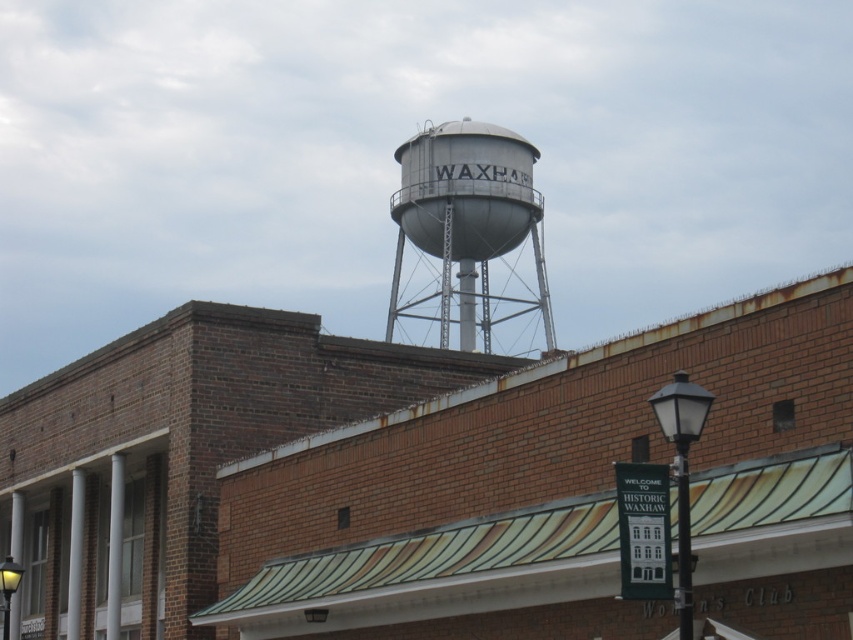
Question: Can you confirm if white metal water tower at upper center is thinner than silver metallic water tower at upper center?

Choices:
 (A) yes
 (B) no

Answer: (B)

Question: Can you confirm if white metal water tower at upper center is positioned to the right of silver metallic water tower at upper center?

Choices:
 (A) yes
 (B) no

Answer: (B)

Question: Which of the following is the closest to the observer?

Choices:
 (A) (300, 547)
 (B) (540, 212)

Answer: (A)

Question: Which object appears farthest from the camera in this image?

Choices:
 (A) silver metallic water tower at upper center
 (B) white metal water tower at upper center

Answer: (A)

Question: Does white metal water tower at upper center lie behind silver metallic water tower at upper center?

Choices:
 (A) yes
 (B) no

Answer: (B)